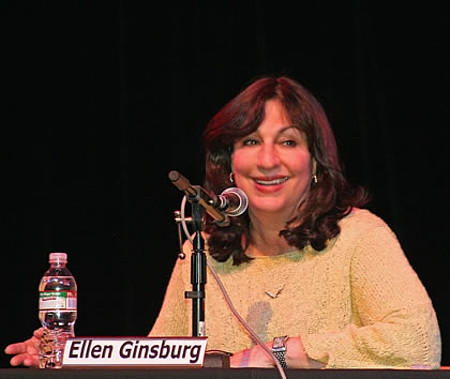
The image size is (450, 379). Identify the location of water bottle, almost full. click(56, 326), click(63, 268).